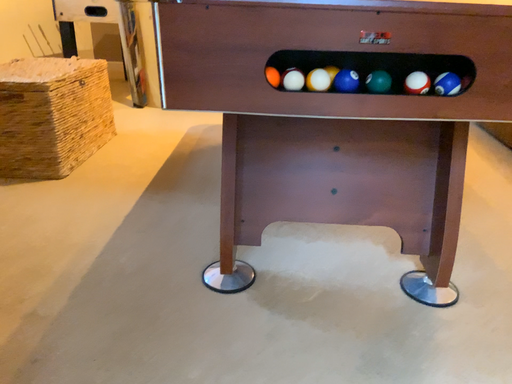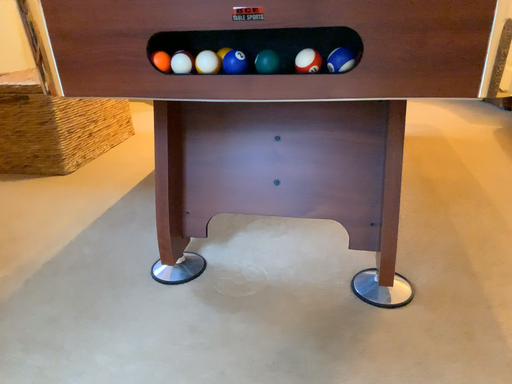
Question: How did the camera likely rotate when shooting the video?

Choices:
 (A) rotated left
 (B) rotated right

Answer: (A)